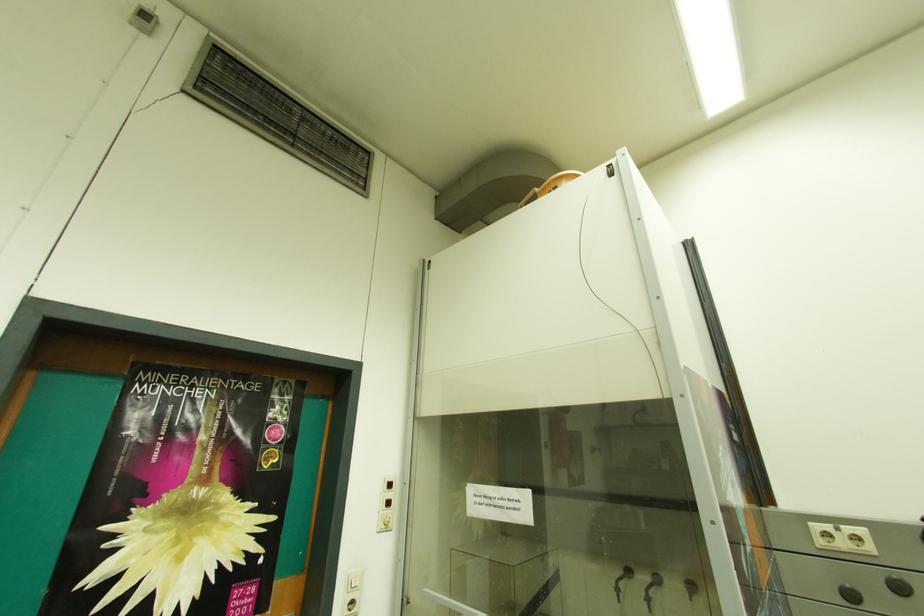
Describe the element at coordinates (351, 592) in the screenshot. Image resolution: width=924 pixels, height=616 pixels. I see `the white power outlet` at that location.